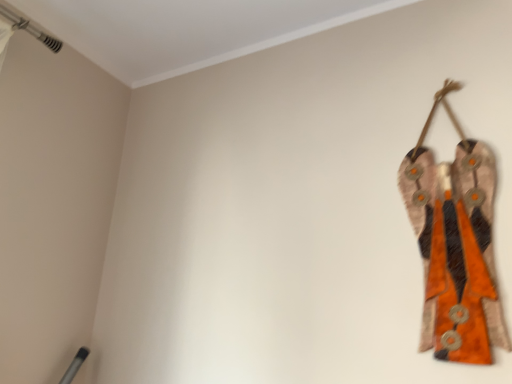
You are a GUI agent. You are given a task and a screenshot of the screen. Output one action in this format:
    pyautogui.click(x=<x>, y=<y>)
    Task: Click on the textured orange fabric at right
    The image size is (512, 384).
    Given the screenshot: What is the action you would take?
    pyautogui.click(x=456, y=251)

What do you see at coordinates (456, 251) in the screenshot? I see `textured orange fabric at right` at bounding box center [456, 251].

Identify the location of white smooth ceiling trim at upper left. This screenshot has width=512, height=384. (276, 40).

What do you see at coordinates (276, 40) in the screenshot? I see `white smooth ceiling trim at upper left` at bounding box center [276, 40].

Image resolution: width=512 pixels, height=384 pixels. In order to click on textured orange fabric at right in this screenshot , I will do `click(456, 251)`.

Between white smooth ceiling trim at upper left and textured orange fabric at right, which one appears on the left side from the viewer's perspective?

white smooth ceiling trim at upper left.

In the image, is white smooth ceiling trim at upper left positioned in front of or behind textured orange fabric at right?

white smooth ceiling trim at upper left is in front of textured orange fabric at right.

Between point (189, 70) and point (439, 328), which one is positioned in front?

Positioned in front is point (439, 328).

From the image's perspective, relative to textured orange fabric at right, is white smooth ceiling trim at upper left above or below?

Based on their image positions, white smooth ceiling trim at upper left is located above textured orange fabric at right.

From a real-world perspective, is white smooth ceiling trim at upper left on textured orange fabric at right?

Yes, from a real-world perspective, white smooth ceiling trim at upper left is above textured orange fabric at right.

Does white smooth ceiling trim at upper left have a greater width compared to textured orange fabric at right?

Indeed, white smooth ceiling trim at upper left has a greater width compared to textured orange fabric at right.

Between white smooth ceiling trim at upper left and textured orange fabric at right, which one has more height?

Standing taller between the two is textured orange fabric at right.

Considering the sizes of objects white smooth ceiling trim at upper left and textured orange fabric at right in the image provided, who is bigger, white smooth ceiling trim at upper left or textured orange fabric at right?

Bigger between the two is white smooth ceiling trim at upper left.

Which is correct: white smooth ceiling trim at upper left is inside textured orange fabric at right, or outside of it?

white smooth ceiling trim at upper left exists outside the volume of textured orange fabric at right.

Are white smooth ceiling trim at upper left and textured orange fabric at right located far from each other?

white smooth ceiling trim at upper left is near textured orange fabric at right, not far away.

Is white smooth ceiling trim at upper left positioned with its back to textured orange fabric at right?

No.

Can you tell me how much white smooth ceiling trim at upper left and textured orange fabric at right differ in facing direction?

The angular difference between white smooth ceiling trim at upper left and textured orange fabric at right is 180 degrees.

How much distance is there between white smooth ceiling trim at upper left and textured orange fabric at right?

white smooth ceiling trim at upper left and textured orange fabric at right are 27.55 inches apart from each other.

This screenshot has width=512, height=384. Identify the location of fancy dress on the right of white smooth ceiling trim at upper left. (x=456, y=251).

Is textured orange fabric at right at the right side of white smooth ceiling trim at upper left?

Yes, textured orange fabric at right is to the right of white smooth ceiling trim at upper left.

Is textured orange fabric at right further to camera compared to white smooth ceiling trim at upper left?

Yes, textured orange fabric at right is further from the camera.

Does point (484, 194) appear closer or farther from the camera than point (232, 52)?

Point (484, 194) is positioned closer to the camera compared to point (232, 52).

From the image's perspective, which one is positioned higher, textured orange fabric at right or white smooth ceiling trim at upper left?

white smooth ceiling trim at upper left appears higher in the image.

From a real-world perspective, is textured orange fabric at right under white smooth ceiling trim at upper left?

Yes.

Is textured orange fabric at right wider or thinner than white smooth ceiling trim at upper left?

In the image, textured orange fabric at right appears to be more narrow than white smooth ceiling trim at upper left.

Which of these two, textured orange fabric at right or white smooth ceiling trim at upper left, stands shorter?

Standing shorter between the two is white smooth ceiling trim at upper left.

Can you confirm if textured orange fabric at right is bigger than white smooth ceiling trim at upper left?

No, textured orange fabric at right is not bigger than white smooth ceiling trim at upper left.

Is white smooth ceiling trim at upper left located within textured orange fabric at right?

No, textured orange fabric at right does not contain white smooth ceiling trim at upper left.

Is textured orange fabric at right far from white smooth ceiling trim at upper left?

No.

Is textured orange fabric at right oriented towards white smooth ceiling trim at upper left?

No, textured orange fabric at right is not turned towards white smooth ceiling trim at upper left.

At what (x,y) coordinates should I click in order to perform the action: click on trim in front of the textured orange fabric at right. Please return your answer as a coordinate pair (x, y). Looking at the image, I should click on (276, 40).

You are a GUI agent. You are given a task and a screenshot of the screen. Output one action in this format:
    pyautogui.click(x=<x>, y=<y>)
    Task: Click on the fancy dress that is under the white smooth ceiling trim at upper left (from a real-world perspective)
    The width and height of the screenshot is (512, 384).
    Given the screenshot: What is the action you would take?
    pyautogui.click(x=456, y=251)

You are a GUI agent. You are given a task and a screenshot of the screen. Output one action in this format:
    pyautogui.click(x=<x>, y=<y>)
    Task: Click on the trim located in front of the textured orange fabric at right
    
    Given the screenshot: What is the action you would take?
    pyautogui.click(x=276, y=40)